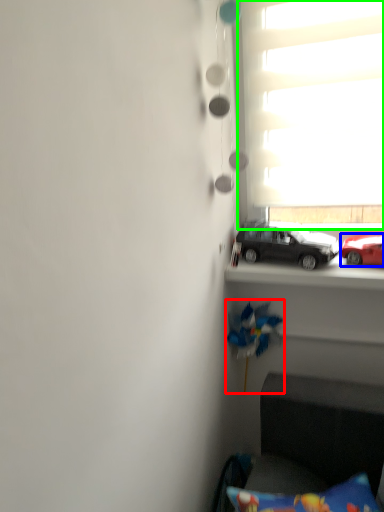
Question: Which object is the farthest from toy (highlighted by a red box)? Choose among these: car (highlighted by a blue box) or window (highlighted by a green box).

Choices:
 (A) car
 (B) window

Answer: (B)